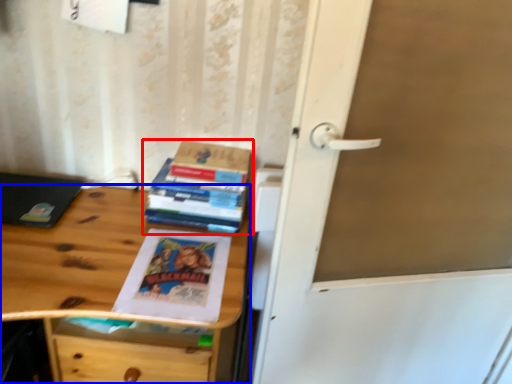
Question: Among these objects, which one is nearest to the camera, book (highlighted by a red box) or desk (highlighted by a blue box)?

Choices:
 (A) book
 (B) desk

Answer: (B)